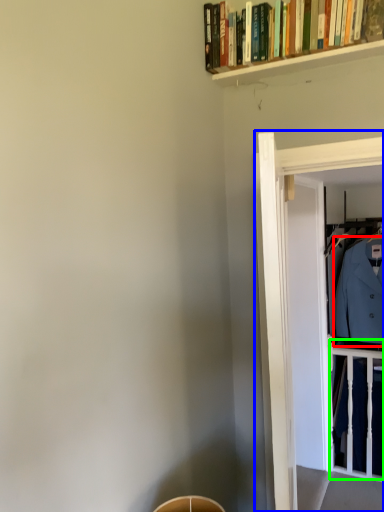
Question: Which object is the closest to the dress shirt (highlighted by a red box)? Choose among these: glass door (highlighted by a blue box) or balustrade (highlighted by a green box).

Choices:
 (A) glass door
 (B) balustrade

Answer: (B)